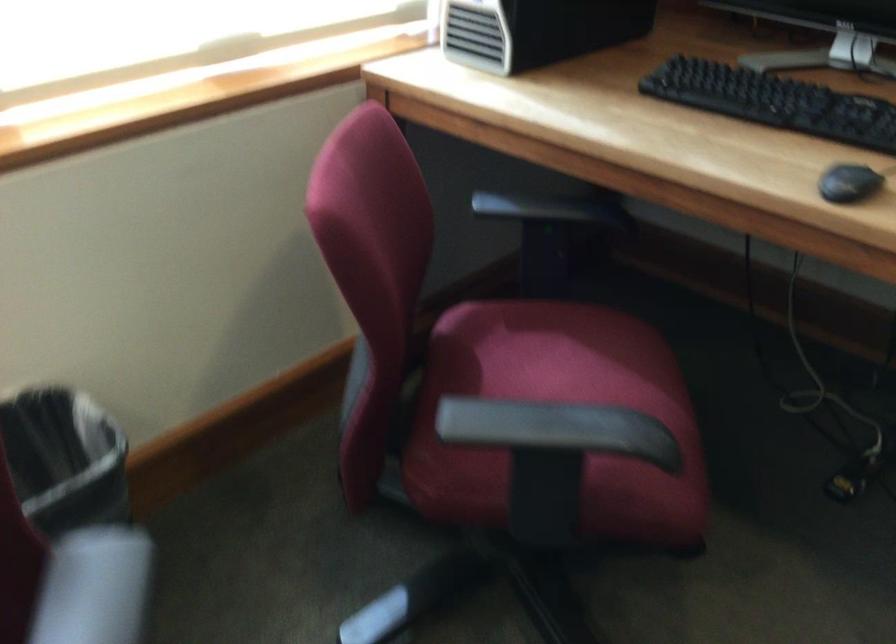
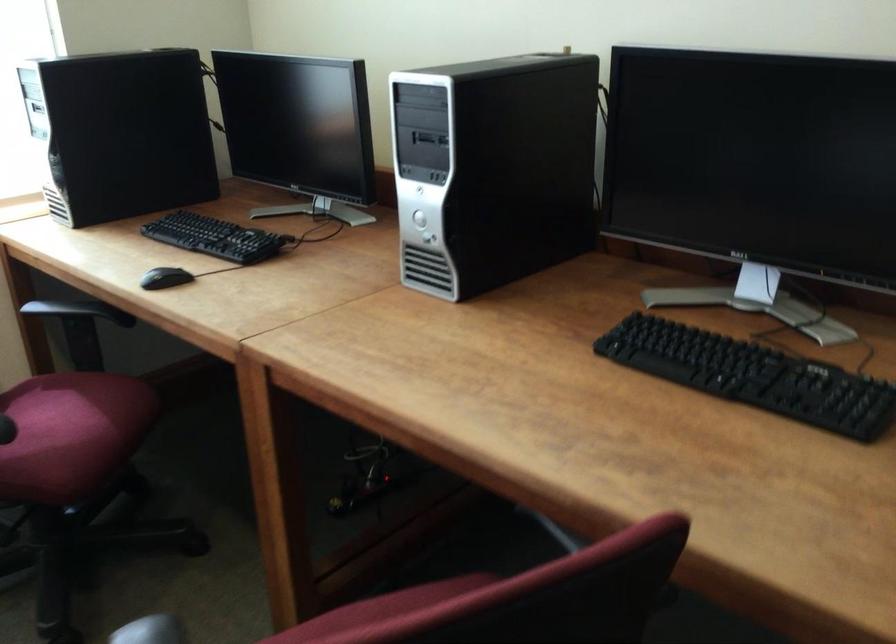
Locate, in the second image, the point that corresponds to [625,402] in the first image.

(73, 428)